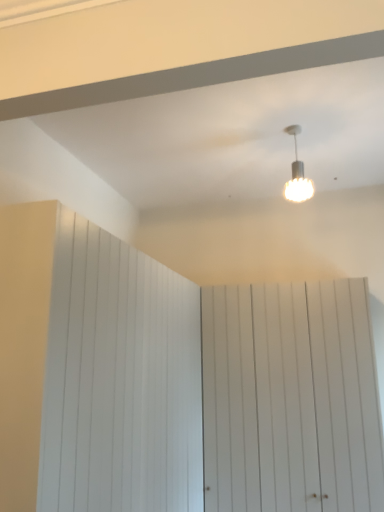
Question: Is white textured lamp at upper center located within white wood barn door at center, the first barn door in the right-to-left sequence?

Choices:
 (A) no
 (B) yes

Answer: (A)

Question: Is white wood barn door at center, the first barn door in the right-to-left sequence, to the left of white textured lamp at upper center from the viewer's perspective?

Choices:
 (A) no
 (B) yes

Answer: (A)

Question: From the image's perspective, is white wood barn door at center, the first barn door in the right-to-left sequence, over white textured lamp at upper center?

Choices:
 (A) no
 (B) yes

Answer: (A)

Question: Is white wood barn door at center, acting as the 2th barn door starting from the left, closer to the viewer compared to white textured lamp at upper center?

Choices:
 (A) yes
 (B) no

Answer: (B)

Question: From a real-world perspective, does white wood barn door at center, acting as the 2th barn door starting from the left, stand above white textured lamp at upper center?

Choices:
 (A) yes
 (B) no

Answer: (B)

Question: From the image's perspective, is white wood barn door at left, which appears as the second barn door when viewed from the right, positioned above or below white wood barn door at center, acting as the 2th barn door starting from the left?

Choices:
 (A) above
 (B) below

Answer: (A)

Question: From a real-world perspective, is white wood barn door at left, which appears as the second barn door when viewed from the right, physically located above or below white wood barn door at center, acting as the 2th barn door starting from the left?

Choices:
 (A) above
 (B) below

Answer: (B)

Question: Based on their sizes in the image, would you say white wood barn door at left, which appears as the 1th barn door when viewed from the left, is bigger or smaller than white wood barn door at center, acting as the 2th barn door starting from the left?

Choices:
 (A) small
 (B) big

Answer: (B)

Question: Is white wood barn door at left, which appears as the second barn door when viewed from the right, inside the boundaries of white wood barn door at center, the first barn door in the right-to-left sequence, or outside?

Choices:
 (A) inside
 (B) outside

Answer: (B)

Question: Would you say white textured lamp at upper center is to the left or to the right of white wood barn door at center, the first barn door in the right-to-left sequence, in the picture?

Choices:
 (A) right
 (B) left

Answer: (B)

Question: Is white textured lamp at upper center in front of or behind white wood barn door at center, acting as the 2th barn door starting from the left, in the image?

Choices:
 (A) front
 (B) behind

Answer: (A)

Question: Looking at their shapes, would you say white textured lamp at upper center is wider or thinner than white wood barn door at center, acting as the 2th barn door starting from the left?

Choices:
 (A) wide
 (B) thin

Answer: (B)

Question: Is white textured lamp at upper center bigger or smaller than white wood barn door at center, acting as the 2th barn door starting from the left?

Choices:
 (A) big
 (B) small

Answer: (B)

Question: From the image's perspective, is white wood barn door at center, the first barn door in the right-to-left sequence, positioned above or below white wood barn door at left, which appears as the second barn door when viewed from the right?

Choices:
 (A) above
 (B) below

Answer: (B)

Question: Is point (354, 391) closer or farther from the camera than point (117, 371)?

Choices:
 (A) closer
 (B) farther

Answer: (B)